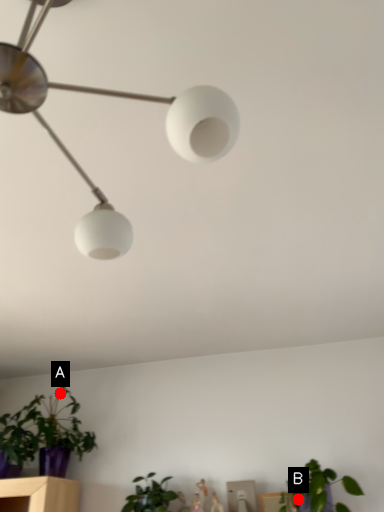
Question: Two points are circled on the image, labeled by A and B beside each circle. Which point is farther from the camera taking this photo?

Choices:
 (A) A is further
 (B) B is further

Answer: (A)